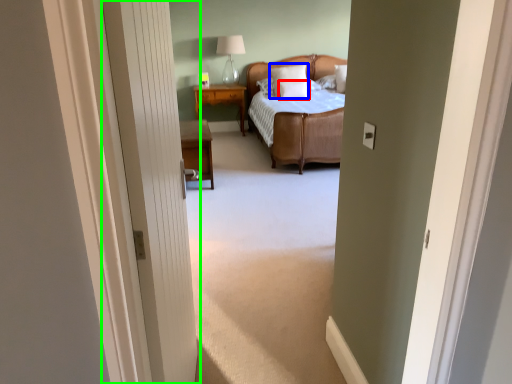
Question: Which object is positioned closest to pillow (highlighted by a red box)? Select from pillow (highlighted by a blue box) and door (highlighted by a green box).

Choices:
 (A) pillow
 (B) door

Answer: (A)